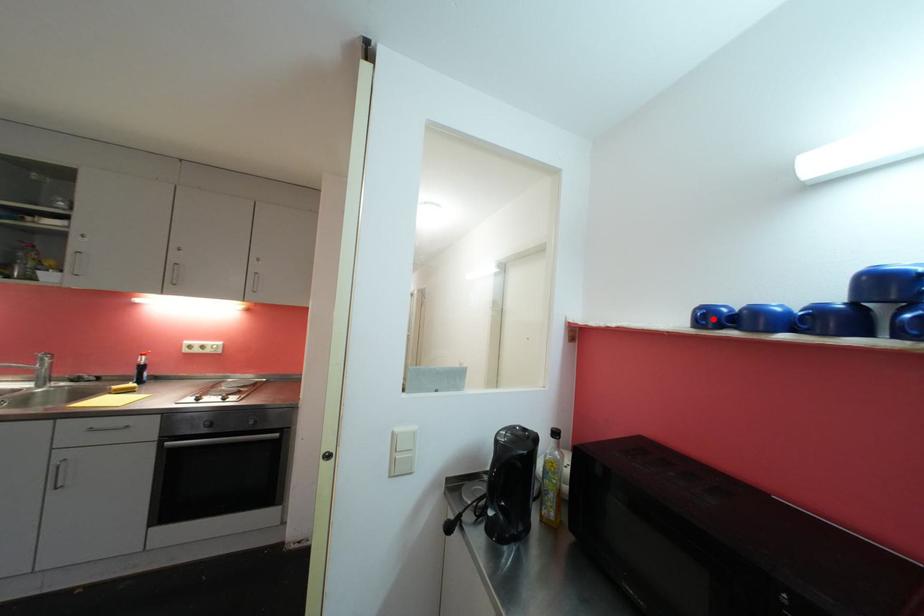
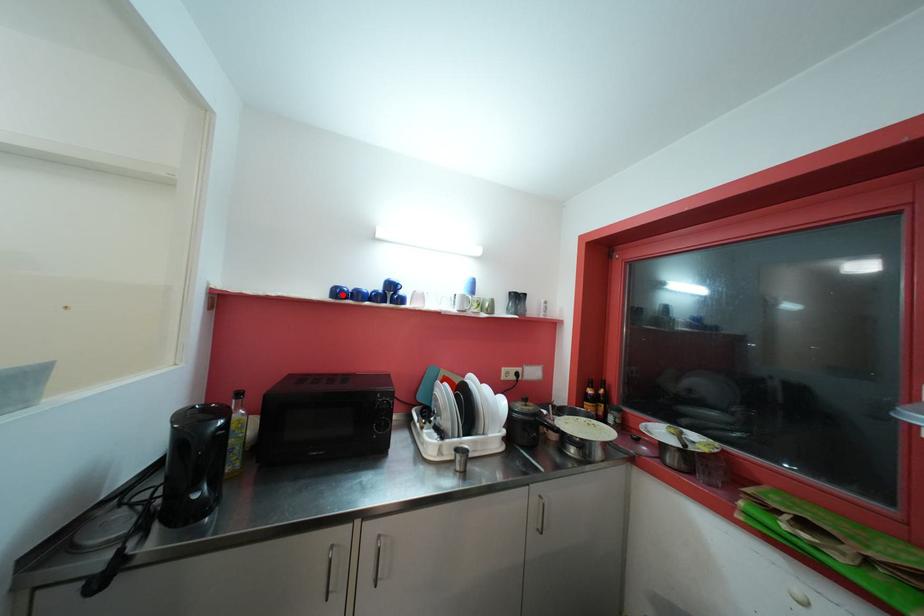
I am providing you with two images of the same scene from different viewpoints. A red point is marked on the first image and another point is marked on the second image. Is the red point in image1 aligned with the point shown in image2?

Yes